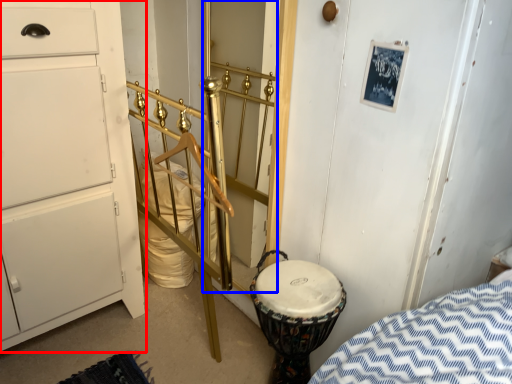
Question: Among these objects, which one is nearest to the camera, chest of drawers (highlighted by a red box) or door (highlighted by a blue box)?

Choices:
 (A) chest of drawers
 (B) door

Answer: (A)